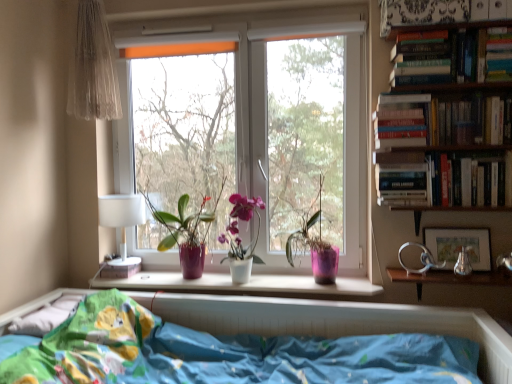
Question: In terms of height, does pink matte pot at center, acting as the third houseplant starting from the left, look taller or shorter compared to hardcover book at upper right, the second paperback book from the right?

Choices:
 (A) tall
 (B) short

Answer: (A)

Question: Does point (304, 235) appear closer or farther from the camera than point (415, 104)?

Choices:
 (A) closer
 (B) farther

Answer: (B)

Question: Which is farther from the hardcover book at upper right, which is counted as the 2th paperback book, starting from the left?

Choices:
 (A) white matte window sill at center
 (B) white fabric lampshade at left
 (C) hardcover book at upper right, which appears as the first book when ordered from the bottom
 (D) white plastic window at center
 (E) hardcover book at upper right, which is the 3th paperback book from top to bottom

Answer: (B)

Question: Considering the real-world distances, which object is closest to the hardcover book at upper right, which is the third book in bottom-to-top order?

Choices:
 (A) white fabric lampshade at left
 (B) white plastic window at center
 (C) transparent plastic window at center
 (D) hardcover book at upper right, acting as the 2th paperback book starting from the top
 (E) matte silver picture frame at right

Answer: (D)